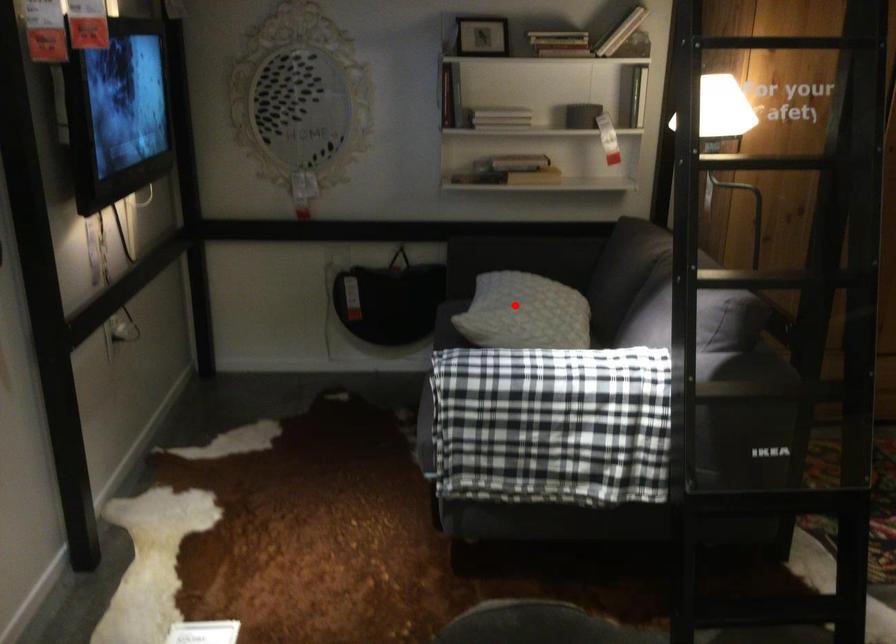
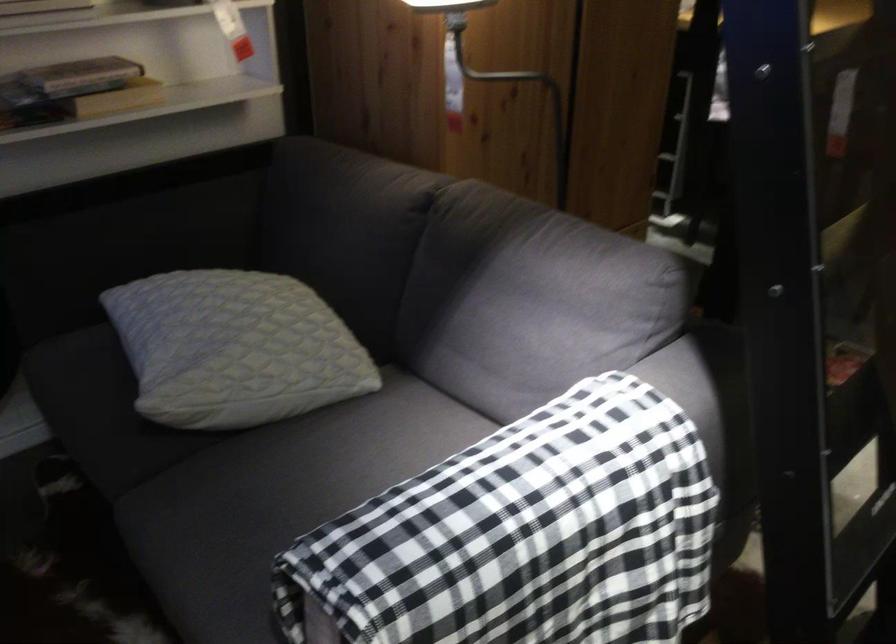
Question: I am providing you with two images of the same scene from different viewpoints. Given a red point in image1, look at the same physical point in image2. Is it:

Choices:
 (A) Closer to the viewpoint
 (B) Farther from the viewpoint

Answer: (A)